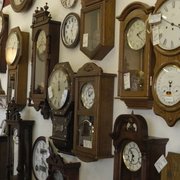
Find the location of `hanging on wall`. hanging on wall is located at coordinates (106, 93), (137, 151), (170, 162), (95, 149), (59, 133), (42, 148), (45, 48), (16, 41), (73, 26), (129, 46).